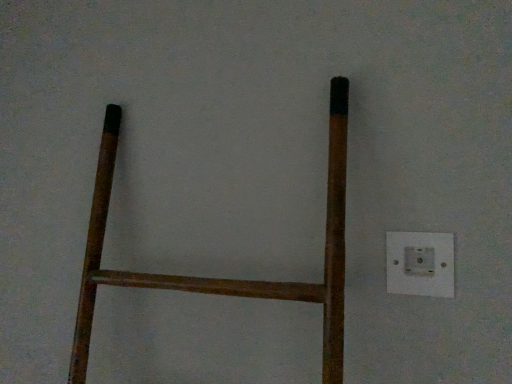
Identify the location of white plastic power plugs and sockets at right. (420, 264).

What is the approximate width of white plastic power plugs and sockets at right?

The width of white plastic power plugs and sockets at right is 0.93 inches.

In order to face white plastic power plugs and sockets at right, should I rotate leftwards or rightwards?

Turn right by 21.051 degrees to look at white plastic power plugs and sockets at right.

What do you see at coordinates (420, 264) in the screenshot?
I see `white plastic power plugs and sockets at right` at bounding box center [420, 264].

Where is `white plastic power plugs and sockets at right`? white plastic power plugs and sockets at right is located at coordinates (420, 264).